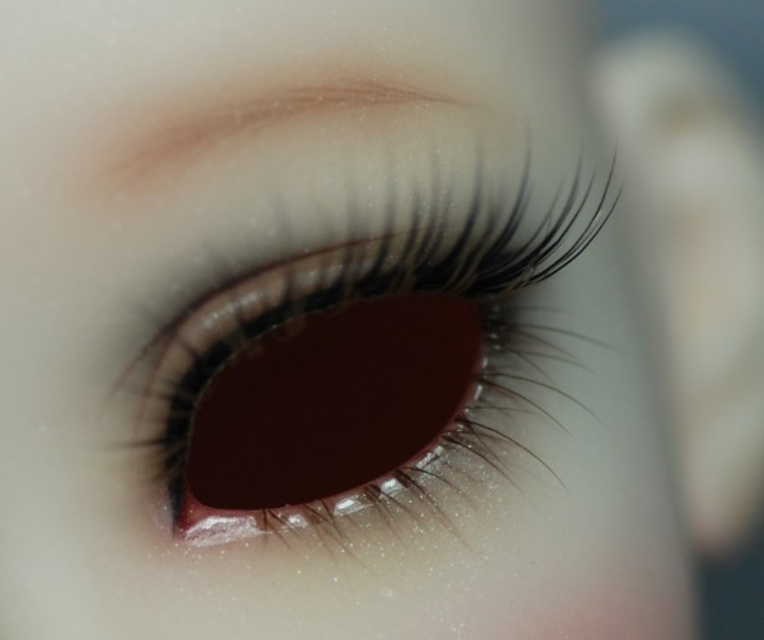
You are a contact lens designer examining this eye image. You need to ensure the shiny brown contact lens at center fits properly without overlapping the matte brown eyebrow at upper center. Based on the image, will the contact lens at center stay within the boundaries of the eye and not interfere with the eyebrow?

The shiny brown contact lens at center is taller than matte brown eyebrow at upper center, so it will extend beyond the eye area and potentially interfere with the eyebrow.

You are a optometrist examining a patient. You notice the shiny brown contact lens at center and the matte brown eyebrow at upper center. Which object is wider when viewed from your perspective?

The shiny brown contact lens at center might be wider than matte brown eyebrow at upper center according to the description.

You are a optometrist examining a patient. You see the shiny brown contact lens at center. If the patient is sitting 12.43 inches away from you, can you clearly see the contact lens details?

The shiny brown contact lens at center and viewer are 12.43 inches apart from each other. At this distance, an optometrist can clearly see the contact lens details for examination purposes.